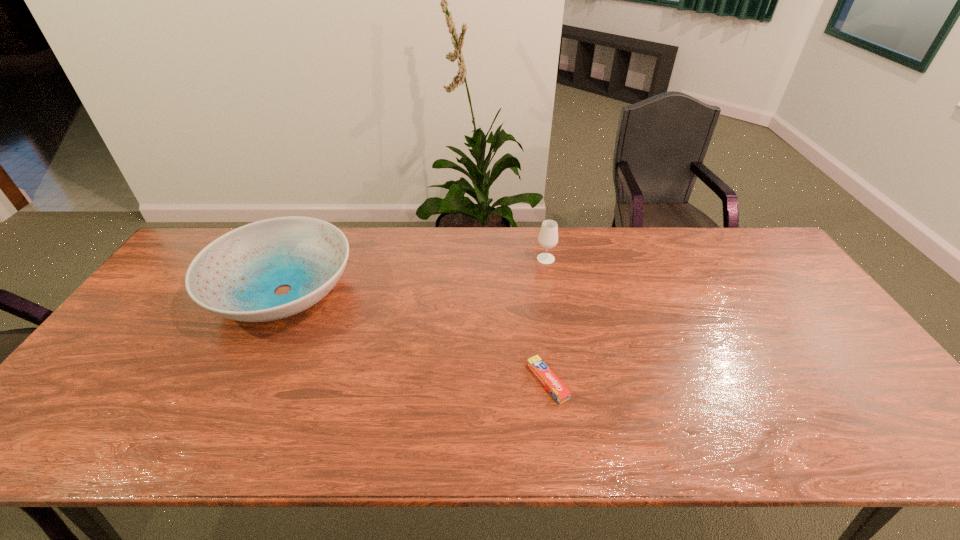
I want to click on object that is at the far left corner, so click(x=235, y=276).

Where is `vacant region at the far edge`? vacant region at the far edge is located at coordinates (617, 233).

The width and height of the screenshot is (960, 540). In order to click on vacant point at the near edge in this screenshot , I will do `click(486, 447)`.

In order to click on vacant space at the left edge of the desktop in this screenshot , I will do (62, 412).

In the image, there is a desktop. Where is `vacant space at the near left corner`? The image size is (960, 540). vacant space at the near left corner is located at coordinates (108, 427).

I want to click on free space between the glass and the shortest object, so pos(546,320).

Locate an element on the screen. The image size is (960, 540). free space between the toothpaste and the glass is located at coordinates (546, 320).

Where is `free space that is in between the shortest object and the glass`? The height and width of the screenshot is (540, 960). free space that is in between the shortest object and the glass is located at coordinates (546, 320).

This screenshot has width=960, height=540. In order to click on unoccupied area between the leftmost object and the glass in this screenshot , I will do `click(415, 275)`.

The image size is (960, 540). I want to click on free space between the dish and the glass, so click(x=415, y=275).